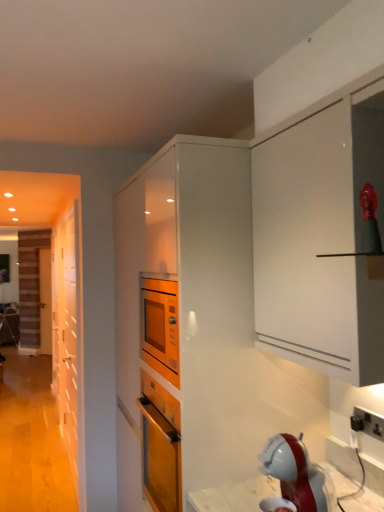
Question: Is black plastic electrical outlet at lower right bigger than white glossy cabinet at center?

Choices:
 (A) yes
 (B) no

Answer: (B)

Question: From the image's perspective, does black plastic electrical outlet at lower right appear higher than white glossy cabinet at center?

Choices:
 (A) yes
 (B) no

Answer: (A)

Question: Considering the relative positions of black plastic electrical outlet at lower right and white glossy cabinet at center in the image provided, is black plastic electrical outlet at lower right to the right of white glossy cabinet at center from the viewer's perspective?

Choices:
 (A) no
 (B) yes

Answer: (B)

Question: From a real-world perspective, is black plastic electrical outlet at lower right located higher than white glossy cabinet at center?

Choices:
 (A) no
 (B) yes

Answer: (A)

Question: Is black plastic electrical outlet at lower right to the left of white glossy cabinet at center from the viewer's perspective?

Choices:
 (A) no
 (B) yes

Answer: (A)

Question: Is wooden at left, placed as the 2th door when sorted from front to back, situated inside black plastic electrical outlet at lower right or outside?

Choices:
 (A) inside
 (B) outside

Answer: (B)

Question: From their relative heights in the image, would you say wooden at left, marked as the 2th door in a right-to-left arrangement, is taller or shorter than black plastic electrical outlet at lower right?

Choices:
 (A) tall
 (B) short

Answer: (A)

Question: Considering their positions, is wooden at left, placed as the 2th door when sorted from front to back, located in front of or behind black plastic electrical outlet at lower right?

Choices:
 (A) front
 (B) behind

Answer: (B)

Question: From a real-world perspective, is wooden at left, placed as the 2th door when sorted from front to back, physically located above or below black plastic electrical outlet at lower right?

Choices:
 (A) below
 (B) above

Answer: (A)

Question: From the image's perspective, is white glossy cabinet at center positioned above or below wooden door at left, which is the 2th door from back to front?

Choices:
 (A) above
 (B) below

Answer: (A)

Question: Is point (188, 296) positioned closer to the camera than point (66, 309)?

Choices:
 (A) closer
 (B) farther

Answer: (A)

Question: From a real-world perspective, relative to wooden door at left, the 1th door positioned from the front, is white glossy cabinet at center vertically above or below?

Choices:
 (A) below
 (B) above

Answer: (B)

Question: Considering the positions of white glossy cabinet at center and wooden door at left, the first door when ordered from right to left, in the image, is white glossy cabinet at center wider or thinner than wooden door at left, the first door when ordered from right to left,?

Choices:
 (A) thin
 (B) wide

Answer: (B)

Question: Relative to white glossy cabinet at center, is wooden at left, marked as the 2th door in a right-to-left arrangement, in front or behind?

Choices:
 (A) behind
 (B) front

Answer: (A)

Question: From the image's perspective, is wooden at left, placed as the 1th door when sorted from back to front, above or below white glossy cabinet at center?

Choices:
 (A) above
 (B) below

Answer: (B)